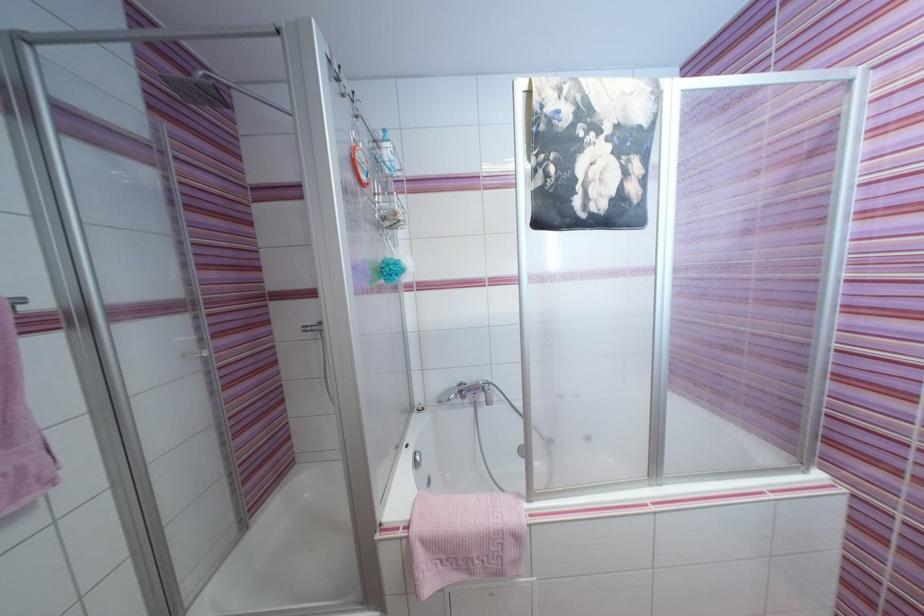
Describe the element at coordinates (196, 352) in the screenshot. I see `the glass shower handle` at that location.